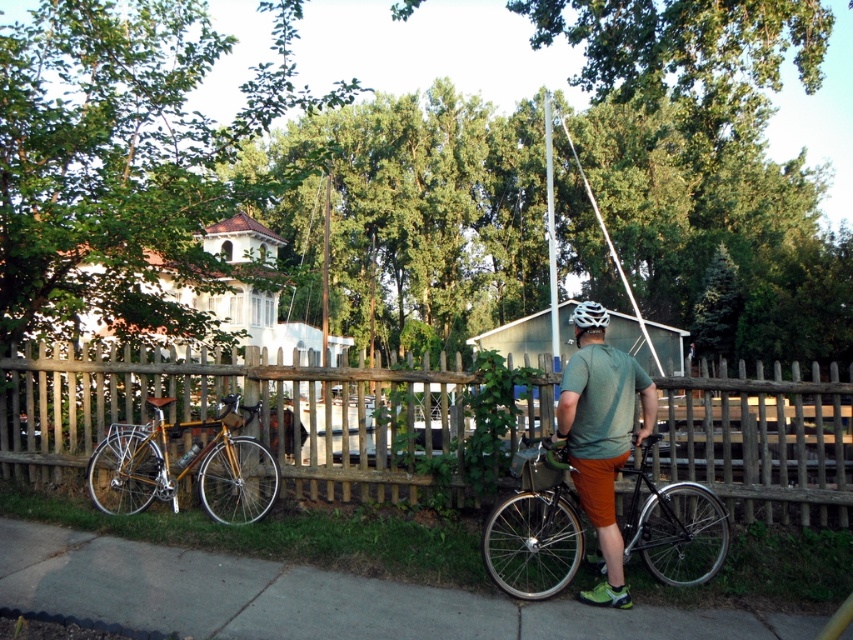
Looking at this image, you are standing at the edge of the suburban scene and want to place a new flower pot between the wooden picket fence at center and the shiny silver bicycle at center. Which object should the flower pot be closer to in order to be placed between them?

The wooden picket fence at center is further to the viewer than the shiny silver bicycle at center, so the flower pot should be placed closer to the shiny silver bicycle at center to be between them.

You are a delivery person who needs to pass through the area between the wooden picket fence at center and the shiny silver bicycle at center. Considering their sizes, which object might require more careful maneuvering around?

The wooden picket fence at center is larger in size than the shiny silver bicycle at center, so it might require more careful maneuvering around.